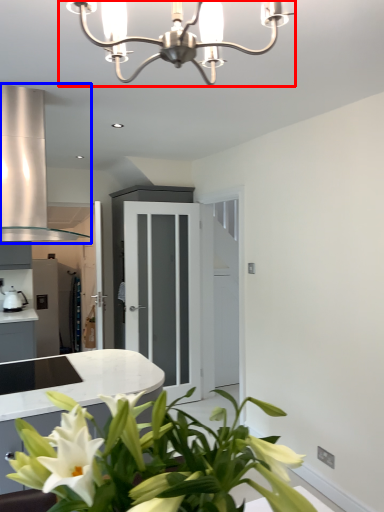
Question: Which object is closer to the camera taking this photo, lamp (highlighted by a red box) or exhaust hood (highlighted by a blue box)?

Choices:
 (A) lamp
 (B) exhaust hood

Answer: (A)